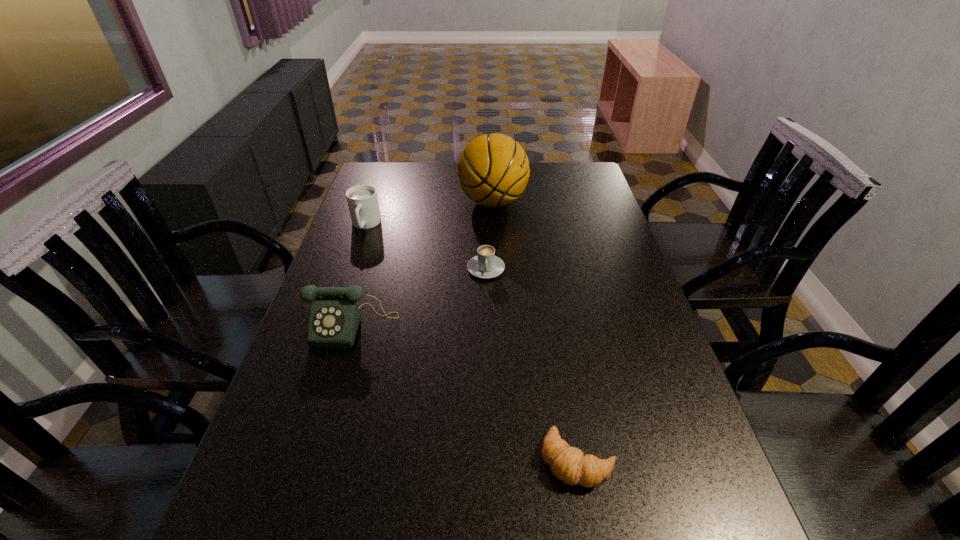
Image resolution: width=960 pixels, height=540 pixels. Find the location of `unoccupied position between the tallest object and the second nearest object`. unoccupied position between the tallest object and the second nearest object is located at coordinates (423, 264).

In order to click on object that is the closest to the shortest object in this screenshot , I will do `click(334, 317)`.

Point out which object is positioned as the second nearest to the taller cappuccino. Please provide its 2D coordinates. Your answer should be formatted as a tuple, i.e. [(x, y)], where the tuple contains the x and y coordinates of a point satisfying the conditions above.

[(334, 317)]

Locate an element on the screen. vacant position in the image that satisfies the following two spatial constraints: 1. on the surface of the tallest object near the brand logo; 2. on the dial of the telephone is located at coordinates (498, 326).

Find the location of a particular element. vacant point that satisfies the following two spatial constraints: 1. on the surface of the tallest object near the brand logo; 2. on the dial of the telephone is located at coordinates (498, 326).

The image size is (960, 540). I want to click on free space that satisfies the following two spatial constraints: 1. on the surface of the tallest object near the brand logo; 2. on the side with the handle of the farther cappuccino, so click(x=493, y=225).

The height and width of the screenshot is (540, 960). What are the coordinates of `vacant position in the image that satisfies the following two spatial constraints: 1. on the dial of the fourth farthest object; 2. on the left side of the shortest object` in the screenshot? It's located at (314, 460).

Image resolution: width=960 pixels, height=540 pixels. Find the location of `free location that satisfies the following two spatial constraints: 1. on the surface of the tallest object near the brand logo; 2. on the side with the handle of the farther cappuccino`. free location that satisfies the following two spatial constraints: 1. on the surface of the tallest object near the brand logo; 2. on the side with the handle of the farther cappuccino is located at coordinates (493, 225).

Identify the location of vacant space that satisfies the following two spatial constraints: 1. on the surface of the crescent roll near the brand logo; 2. on the right side of the basketball. The width and height of the screenshot is (960, 540). (504, 460).